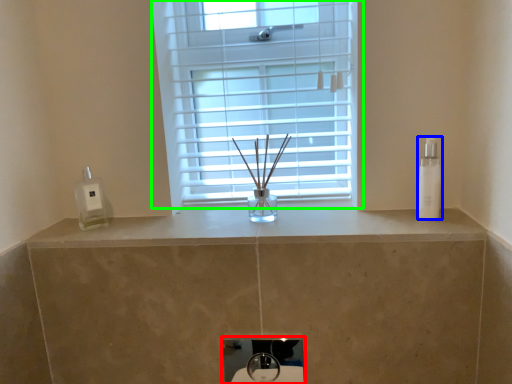
Question: Estimate the real-world distances between objects in this image. Which object is closer to sink (highlighted by a red box), toiletry (highlighted by a blue box) or window (highlighted by a green box)?

Choices:
 (A) toiletry
 (B) window

Answer: (B)